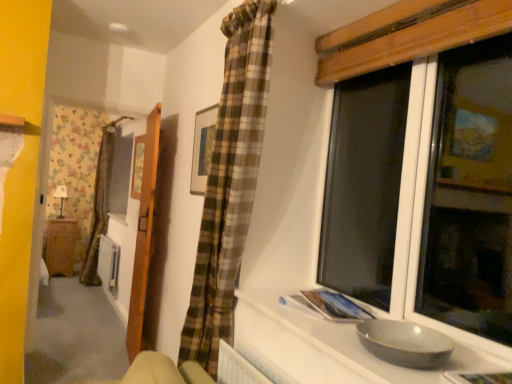
This screenshot has width=512, height=384. I want to click on wooden door at left, so click(144, 235).

What is the approximate width of gray matte bowl at lower right?

It is 20.12 inches.

This screenshot has height=384, width=512. I want to click on wooden picture frame at upper center, which is the first picture frame from back to front, so click(x=137, y=167).

This screenshot has height=384, width=512. In order to click on wooden door at left in this screenshot , I will do `click(144, 235)`.

How far apart are wooden picture frame at upper center, marked as the second picture frame in a front-to-back arrangement, and wooden door at left?

A distance of 1.01 meters exists between wooden picture frame at upper center, marked as the second picture frame in a front-to-back arrangement, and wooden door at left.

Is point (142, 158) more distant than point (145, 147)?

Yes, it is behind point (145, 147).

Are wooden picture frame at upper center, the second picture frame when ordered from right to left, and wooden door at left making contact?

wooden picture frame at upper center, the second picture frame when ordered from right to left, is not next to wooden door at left, and they're not touching.

Is the position of wooden picture frame at upper center, marked as the first picture frame in a left-to-right arrangement, more distant than that of wooden door at left?

Yes, it is.

Is wooden picture frame at upper center, which is the first picture frame from back to front, at the right side of matte black lamp at left?

Yes.

Is matte black lamp at left a part of wooden picture frame at upper center, marked as the first picture frame in a left-to-right arrangement?

Actually, matte black lamp at left is outside wooden picture frame at upper center, marked as the first picture frame in a left-to-right arrangement.

Which is nearer, (133, 189) or (62, 211)?

Clearly, point (133, 189) is closer to the camera than point (62, 211).

Identify the location of lamp below the wooden picture frame at upper center, the second picture frame when ordered from right to left (from the image's perspective). This screenshot has height=384, width=512. (61, 197).

Is gray matte bowl at lower right shorter than wooden framed picture at upper center, the second picture frame positioned from the left?

→ Yes, gray matte bowl at lower right is shorter than wooden framed picture at upper center, the second picture frame positioned from the left.

From a real-world perspective, is gray matte bowl at lower right on top of wooden framed picture at upper center, which appears as the 1th picture frame when viewed from the front?

No, from a real-world perspective, gray matte bowl at lower right is not above wooden framed picture at upper center, which appears as the 1th picture frame when viewed from the front.

In the scene shown: Is wooden framed picture at upper center, which appears as the 1th picture frame when viewed from the front, at the back of gray matte bowl at lower right?

No, gray matte bowl at lower right's orientation is not away from wooden framed picture at upper center, which appears as the 1th picture frame when viewed from the front.

Considering the relative sizes of gray matte bowl at lower right and matte black lamp at left in the image provided, is gray matte bowl at lower right shorter than matte black lamp at left?

Correct, gray matte bowl at lower right is not as tall as matte black lamp at left.

Is gray matte bowl at lower right not within matte black lamp at left?

Yes, gray matte bowl at lower right is located beyond the bounds of matte black lamp at left.

Is gray matte bowl at lower right facing towards matte black lamp at left?

No, gray matte bowl at lower right is not oriented towards matte black lamp at left.

Can you confirm if gray matte bowl at lower right is thinner than wooden door at left?

No.

Is gray matte bowl at lower right smaller than wooden door at left?

Yes, gray matte bowl at lower right is smaller than wooden door at left.

Identify the location of door behind the gray matte bowl at lower right. (144, 235).

Between point (209, 109) and point (138, 178), which one is positioned in front?

The point (209, 109) is closer.

Is wooden framed picture at upper center, positioned as the second picture frame in back-to-front order, to the right of wooden picture frame at upper center, which is the first picture frame from back to front, from the viewer's perspective?

Result: Yes, wooden framed picture at upper center, positioned as the second picture frame in back-to-front order, is to the right of wooden picture frame at upper center, which is the first picture frame from back to front.

From a real-world perspective, between wooden framed picture at upper center, which appears as the 1th picture frame when viewed from the front, and wooden picture frame at upper center, marked as the first picture frame in a left-to-right arrangement, who is vertically lower?

wooden picture frame at upper center, marked as the first picture frame in a left-to-right arrangement, from a real-world perspective.

From a real-world perspective, is matte black lamp at left below wooden framed picture at upper center, the second picture frame positioned from the left?

Yes, from a real-world perspective, matte black lamp at left is under wooden framed picture at upper center, the second picture frame positioned from the left.

Which is behind, matte black lamp at left or wooden framed picture at upper center, the second picture frame positioned from the left?

matte black lamp at left is behind.

Is matte black lamp at left spatially inside wooden framed picture at upper center, the first picture frame viewed from the right, or outside of it?

The correct answer is: outside.

Does point (64, 191) come behind point (198, 182)?

Yes, it is behind point (198, 182).

The image size is (512, 384). I want to click on door in front of the wooden picture frame at upper center, marked as the first picture frame in a left-to-right arrangement, so click(x=144, y=235).

This screenshot has height=384, width=512. I want to click on lamp below the wooden picture frame at upper center, marked as the second picture frame in a front-to-back arrangement (from a real-world perspective), so click(x=61, y=197).

Based on their spatial positions, is wooden cabinet at left or gray matte bowl at lower right further from matte black lamp at left?

gray matte bowl at lower right is further to matte black lamp at left.

Looking at the image, which one is located closer to wooden cabinet at left, matte black lamp at left or wooden picture frame at upper center, which is the first picture frame from back to front?

matte black lamp at left is positioned closer to the anchor wooden cabinet at left.

When comparing their distances from wooden cabinet at left, does wooden picture frame at upper center, marked as the second picture frame in a front-to-back arrangement, or matte black lamp at left seem closer?

matte black lamp at left.

Looking at the image, which one is located further to wooden cabinet at left, wooden door at left or matte black lamp at left?

wooden door at left.

When comparing their distances from matte black lamp at left, does wooden door at left or wooden picture frame at upper center, which is the first picture frame from back to front, seem closer?

Based on the image, wooden picture frame at upper center, which is the first picture frame from back to front, appears to be nearer to matte black lamp at left.

When comparing their distances from wooden picture frame at upper center, marked as the first picture frame in a left-to-right arrangement, does wooden cabinet at left or wooden door at left seem further?

Based on the image, wooden cabinet at left appears to be further to wooden picture frame at upper center, marked as the first picture frame in a left-to-right arrangement.

Looking at the image, which one is located further to wooden door at left, gray matte bowl at lower right or wooden cabinet at left?

wooden cabinet at left is positioned further to the anchor wooden door at left.

From the image, which object appears to be nearer to wooden picture frame at upper center, marked as the first picture frame in a left-to-right arrangement, gray matte bowl at lower right or wooden cabinet at left?

Among the two, wooden cabinet at left is located nearer to wooden picture frame at upper center, marked as the first picture frame in a left-to-right arrangement.

Image resolution: width=512 pixels, height=384 pixels. What are the coordinates of `furniture between wooden picture frame at upper center, marked as the second picture frame in a front-to-back arrangement, and matte black lamp at left, along the z-axis` in the screenshot? It's located at [x=61, y=246].

Locate an element on the screen. furniture between wooden door at left and matte black lamp at left along the z-axis is located at coordinates (61, 246).

What are the coordinates of `door between wooden framed picture at upper center, which appears as the 1th picture frame when viewed from the front, and wooden picture frame at upper center, the second picture frame when ordered from right to left, along the z-axis` in the screenshot? It's located at (144, 235).

The image size is (512, 384). Find the location of `picture frame located between wooden framed picture at upper center, which appears as the 1th picture frame when viewed from the front, and matte black lamp at left in the depth direction`. picture frame located between wooden framed picture at upper center, which appears as the 1th picture frame when viewed from the front, and matte black lamp at left in the depth direction is located at coordinates (137, 167).